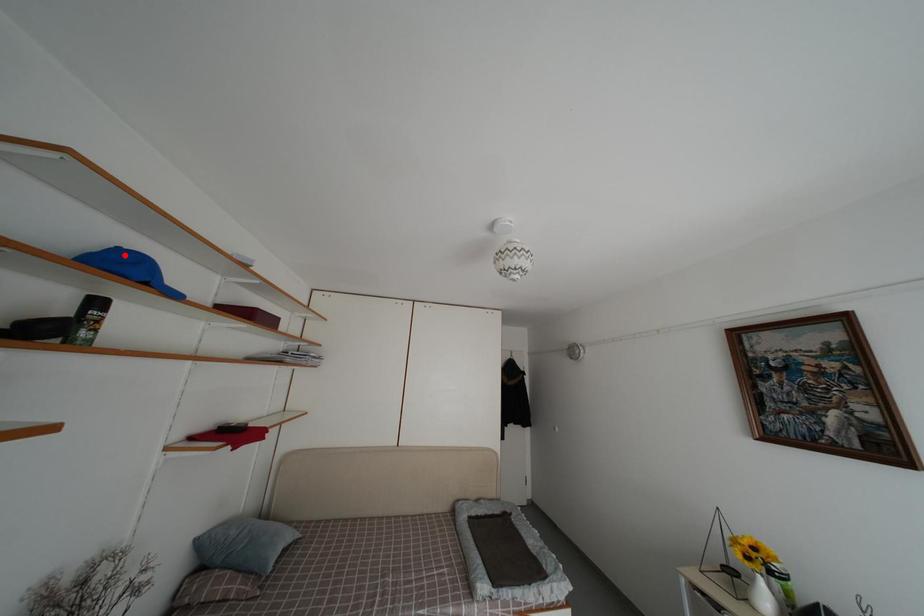
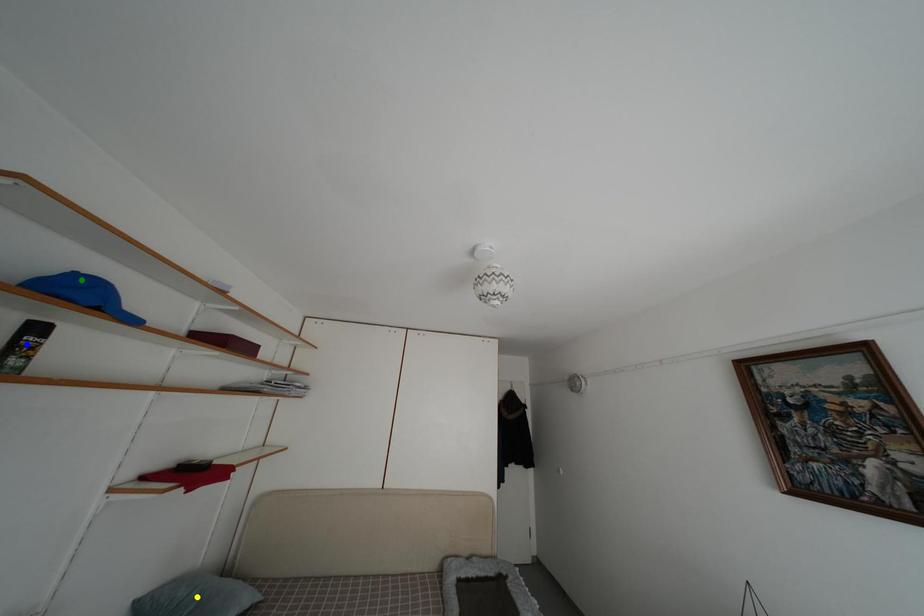
Question: I am providing you with two images of the same scene from different viewpoints. A red point is marked on the first image. You are given multiple points on the second image. Which spot in image 2 lines up with the point in image 1?

Choices:
 (A) green point
 (B) yellow point
 (C) blue point

Answer: (A)